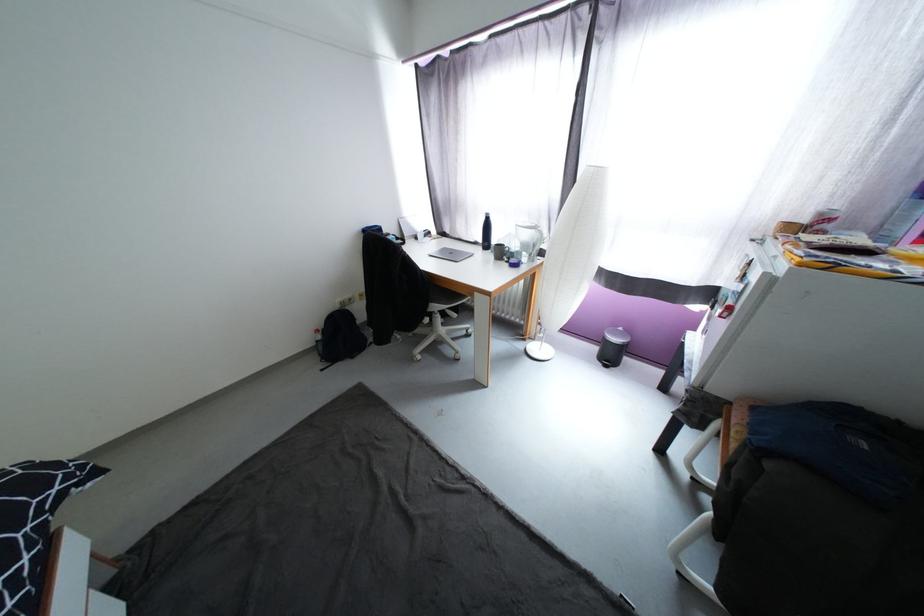
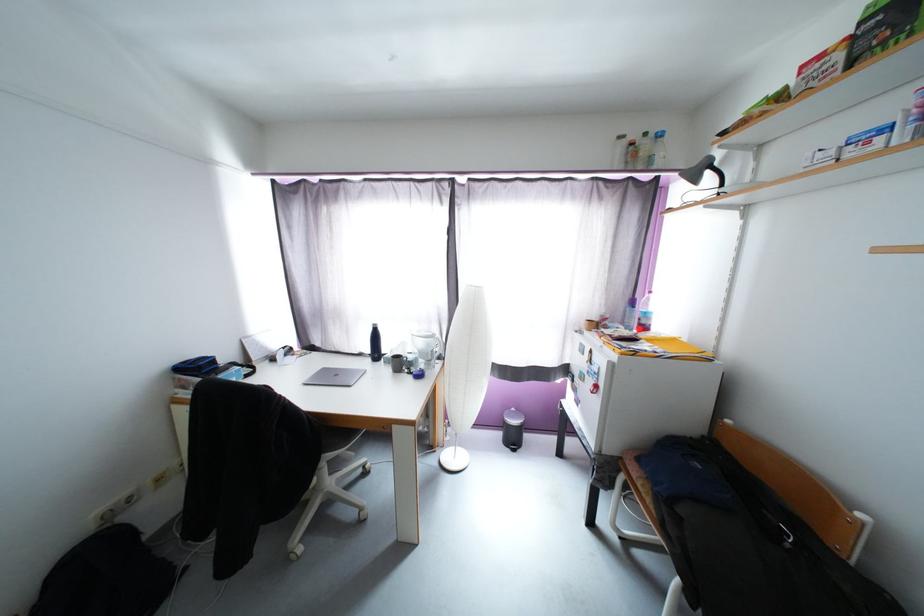
Question: I am providing you with two images of the same scene from different viewpoints. Which of the following objects are not visible in image2?

Choices:
 (A) black backpack
 (B) black water bottle
 (C) grey lamp head
 (D) none of these

Answer: (D)